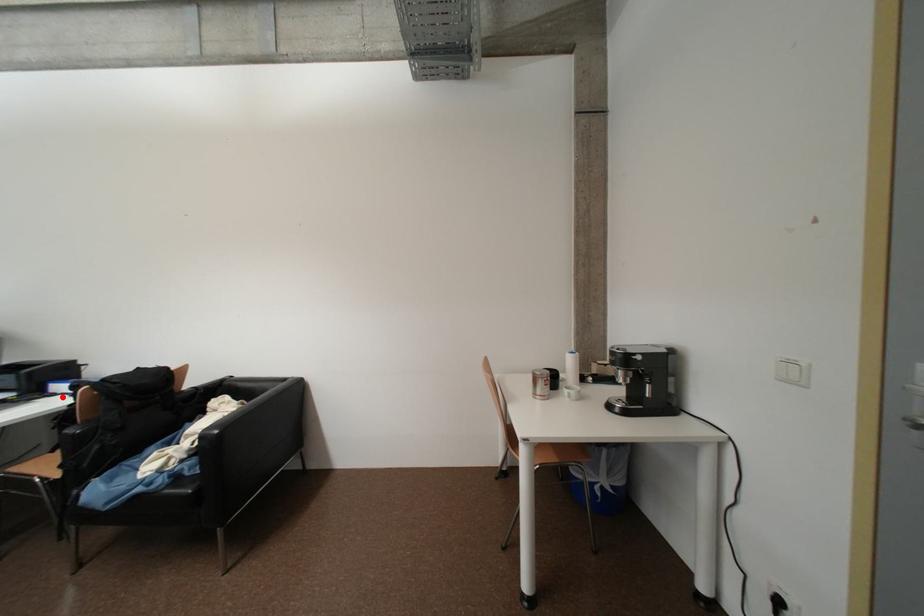
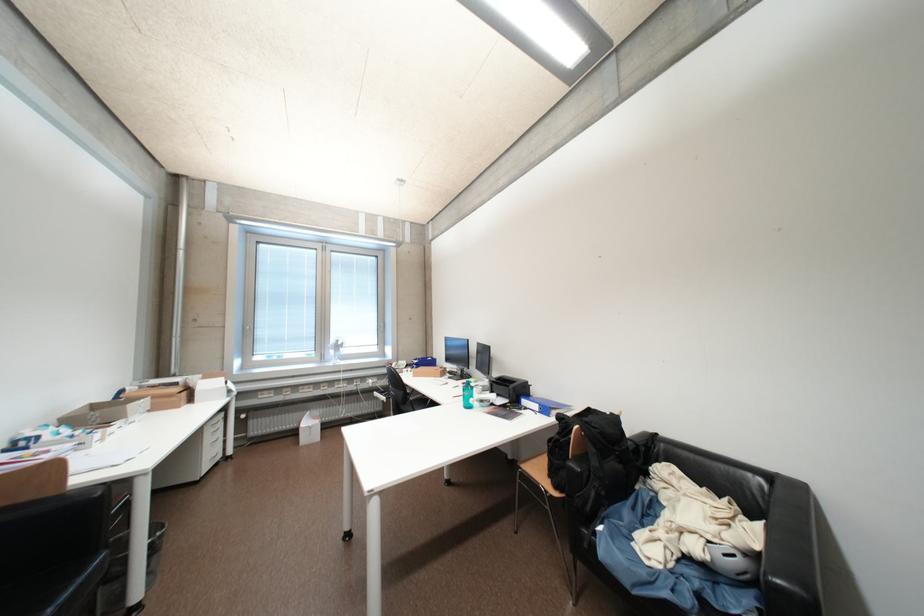
Find the pixel in the second image that matches the highlighted location in the first image.

(533, 411)